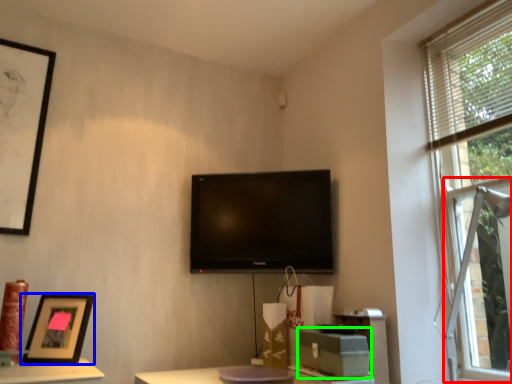
Question: Considering the real-world distances, which object is closest to bay window (highlighted by a red box)? picture frame (highlighted by a blue box) or cardboard box (highlighted by a green box).

Choices:
 (A) picture frame
 (B) cardboard box

Answer: (B)